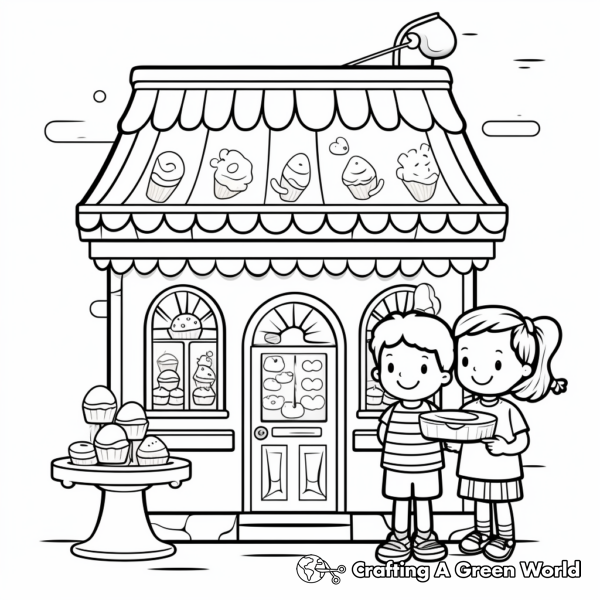
Find the location of a particular element. The width and height of the screenshot is (600, 600). door is located at coordinates (294, 425).